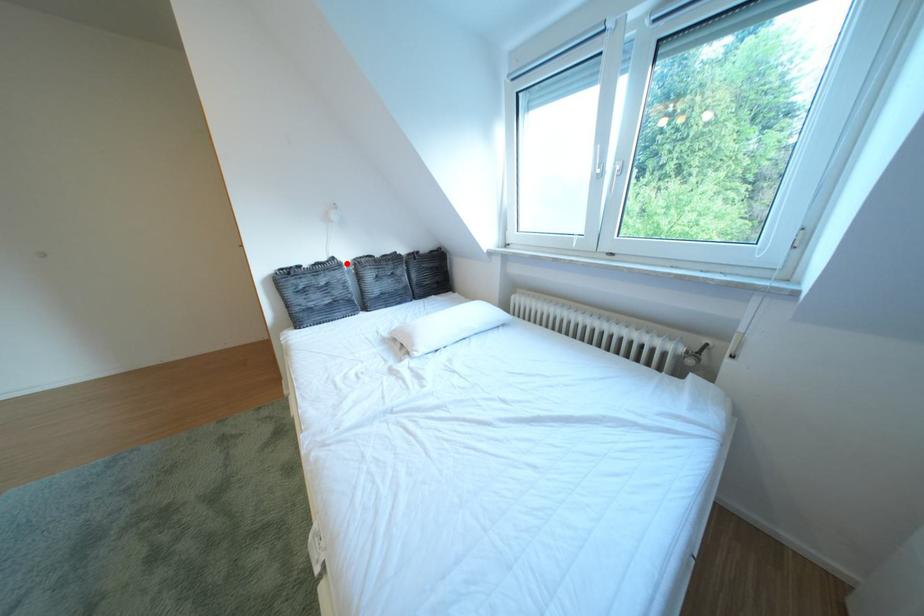
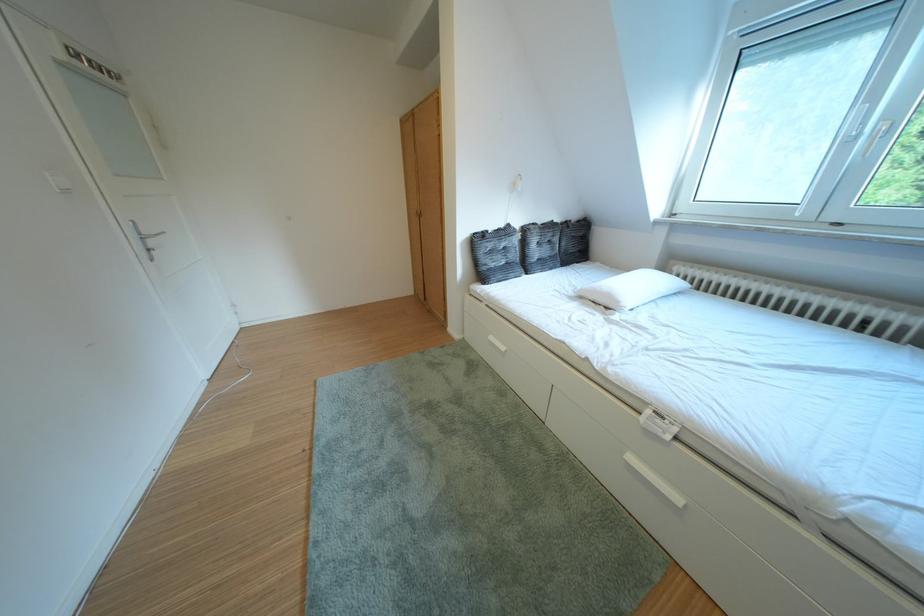
Question: I am providing you with two images of the same scene from different viewpoints. A red point is marked on the first image. Is the red point's position out of view in image 2?

Choices:
 (A) Yes
 (B) No

Answer: (B)